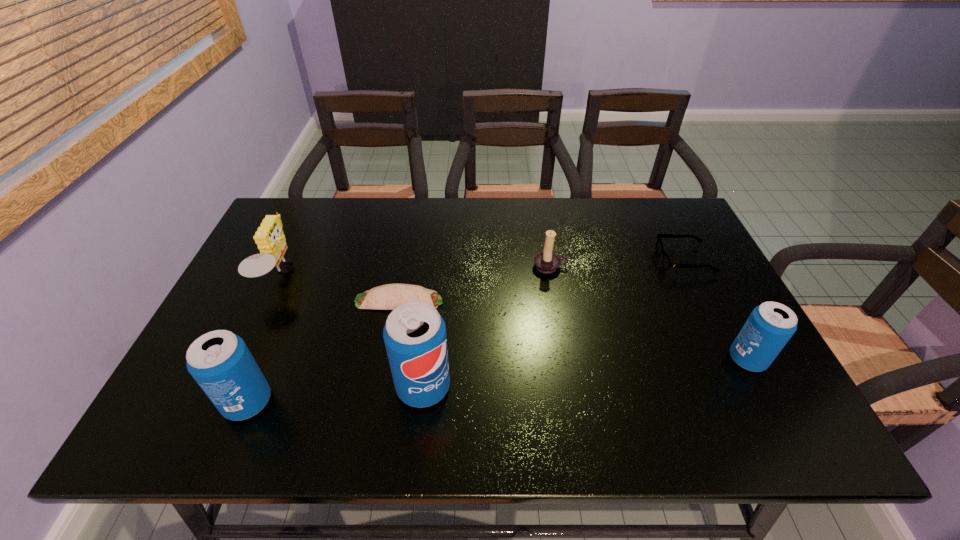
Image resolution: width=960 pixels, height=540 pixels. What are the coordinates of `vacant space located 0.240m on the left of the shortest soda can` in the screenshot? It's located at (627, 359).

You are a GUI agent. You are given a task and a screenshot of the screen. Output one action in this format:
    pyautogui.click(x=<x>, y=<y>)
    Task: Click on the vacant position located at the bitten end of the shortest object
    The width and height of the screenshot is (960, 540).
    Given the screenshot: What is the action you would take?
    pyautogui.click(x=584, y=301)

The height and width of the screenshot is (540, 960). Find the location of `vacant area situated 0.340m on the front-facing side of the sponge`. vacant area situated 0.340m on the front-facing side of the sponge is located at coordinates (417, 275).

Where is `free point located on the wick of the candle holder`? free point located on the wick of the candle holder is located at coordinates (559, 316).

Find the location of `vacant space located 0.320m on the arms of the sixth tallest object`. vacant space located 0.320m on the arms of the sixth tallest object is located at coordinates (549, 261).

This screenshot has width=960, height=540. Find the location of `vacant space located on the arms of the sixth tallest object`. vacant space located on the arms of the sixth tallest object is located at coordinates (626, 261).

This screenshot has width=960, height=540. Identify the location of free spot located 0.060m on the arms of the sixth tallest object. (639, 261).

The width and height of the screenshot is (960, 540). I want to click on soda can at the left edge, so click(220, 362).

Where is `sponge that is positioned at the left edge`? This screenshot has height=540, width=960. sponge that is positioned at the left edge is located at coordinates (269, 237).

Locate an element on the screen. soda can at the right edge is located at coordinates (769, 327).